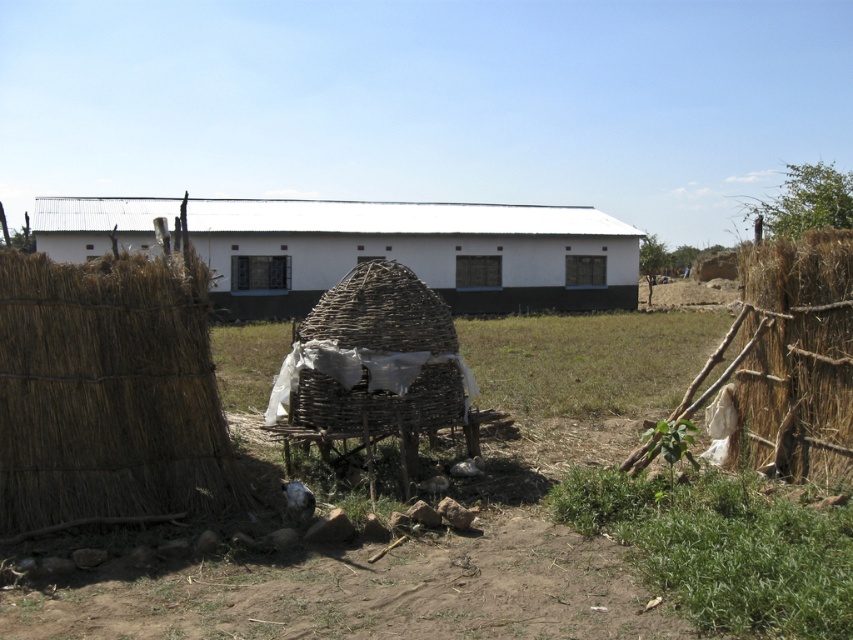
Question: Where is brown dirt field at center located in relation to brown straw hay at right in the image?

Choices:
 (A) left
 (B) right

Answer: (A)

Question: Is brown woven hay at left in front of brown straw hay at right?

Choices:
 (A) no
 (B) yes

Answer: (B)

Question: Among these objects, which one is nearest to the camera?

Choices:
 (A) brown woven hay at left
 (B) brown dirt field at center
 (C) white corrugated metal building at center
 (D) brown straw hay at right

Answer: (B)

Question: Which object is the farthest from the brown woven hay at left?

Choices:
 (A) brown straw hay at right
 (B) white corrugated metal building at center

Answer: (B)

Question: Does brown woven hay at left appear on the right side of white corrugated metal building at center?

Choices:
 (A) yes
 (B) no

Answer: (A)

Question: Which object is farther from the camera taking this photo?

Choices:
 (A) white corrugated metal building at center
 (B) brown dirt field at center
 (C) brown woven hay at left
 (D) brown straw hay at right

Answer: (A)